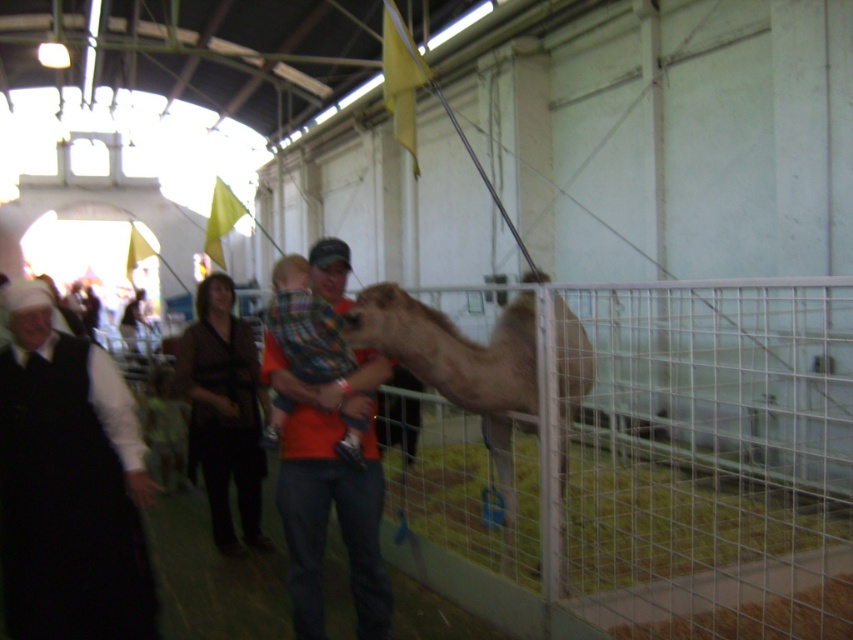
Question: Considering the relative positions of white wire fence at right and orange cotton shirt at center in the image provided, where is white wire fence at right located with respect to orange cotton shirt at center?

Choices:
 (A) left
 (B) right

Answer: (B)

Question: Is white wire fence at right below fuzzy beige camel at center?

Choices:
 (A) no
 (B) yes

Answer: (A)

Question: Based on their relative distances, which object is farther from the orange cotton shirt at center?

Choices:
 (A) white wire fence at right
 (B) fuzzy beige camel at center

Answer: (A)

Question: Based on their relative distances, which object is farther from the fuzzy beige camel at center?

Choices:
 (A) orange cotton shirt at center
 (B) black fabric at left

Answer: (B)

Question: Is black fabric at left bigger than orange cotton shirt at center?

Choices:
 (A) yes
 (B) no

Answer: (B)

Question: Which object is the farthest from the black fabric at left?

Choices:
 (A) orange cotton shirt at center
 (B) fuzzy beige camel at center

Answer: (B)